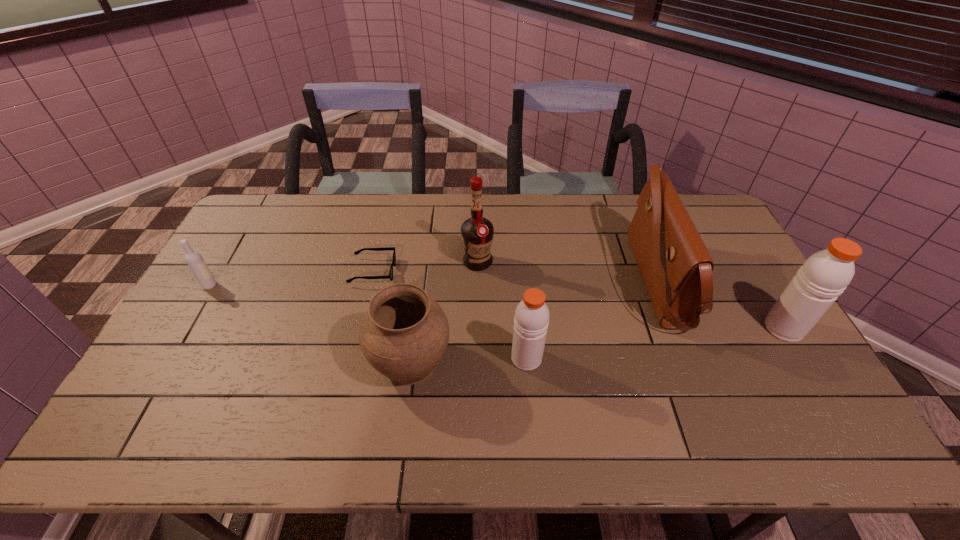
Select which object is the second closest to the right shaker. Please provide its 2D coordinates. Your answer should be formatted as a tuple, i.e. [(x, y)], where the tuple contains the x and y coordinates of a point satisfying the conditions above.

[(531, 320)]

Identify the location of vacant area that satisfies the following two spatial constraints: 1. on the front and back of the fourth object from left to right; 2. on the right side of the nearer shaker. Image resolution: width=960 pixels, height=540 pixels. (477, 358).

Identify the location of free location that satisfies the following two spatial constraints: 1. on the front side of the leftmost object; 2. on the right side of the urn. (166, 361).

What are the coordinates of `vacant position in the image that satisfies the following two spatial constraints: 1. on the front and back of the liquor; 2. on the left side of the taller shaker` in the screenshot? It's located at (477, 328).

Identify the location of vacant space that satisfies the following two spatial constraints: 1. on the back side of the right shaker; 2. on the front flap of the sixth object from left to right. (756, 282).

This screenshot has height=540, width=960. I want to click on free space in the image that satisfies the following two spatial constraints: 1. on the front and back of the left shaker; 2. on the right side of the liquor, so click(x=477, y=358).

Find the location of a particular element. This screenshot has height=540, width=960. free space that satisfies the following two spatial constraints: 1. on the arms of the rightmost object; 2. on the left side of the shortest object is located at coordinates (359, 328).

Locate an element on the screen. The width and height of the screenshot is (960, 540). vacant area that satisfies the following two spatial constraints: 1. on the arms of the spectacles; 2. on the right side of the rightmost object is located at coordinates (359, 328).

This screenshot has height=540, width=960. What are the coordinates of `free space in the image that satisfies the following two spatial constraints: 1. on the front flap of the satchel; 2. on the front side of the left shaker` in the screenshot? It's located at (688, 358).